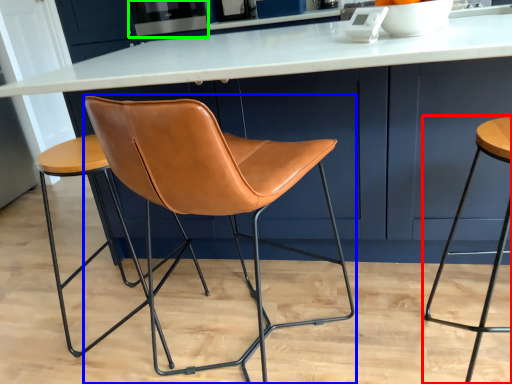
Question: Which object is positioned farthest from stool (highlighted by a red box)? Select from chair (highlighted by a blue box) and appliance (highlighted by a green box).

Choices:
 (A) chair
 (B) appliance

Answer: (B)